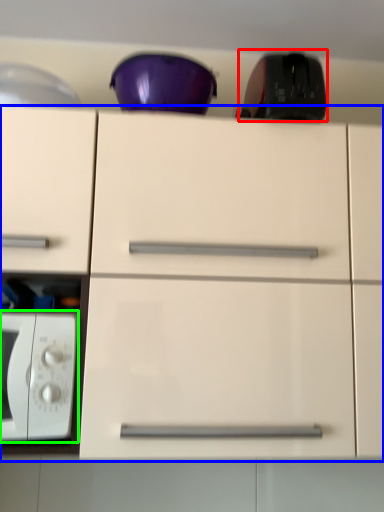
Question: Which object is positioned closest to appliance (highlighted by a red box)? Select from cabinetry (highlighted by a blue box) and microwave oven (highlighted by a green box).

Choices:
 (A) cabinetry
 (B) microwave oven

Answer: (A)